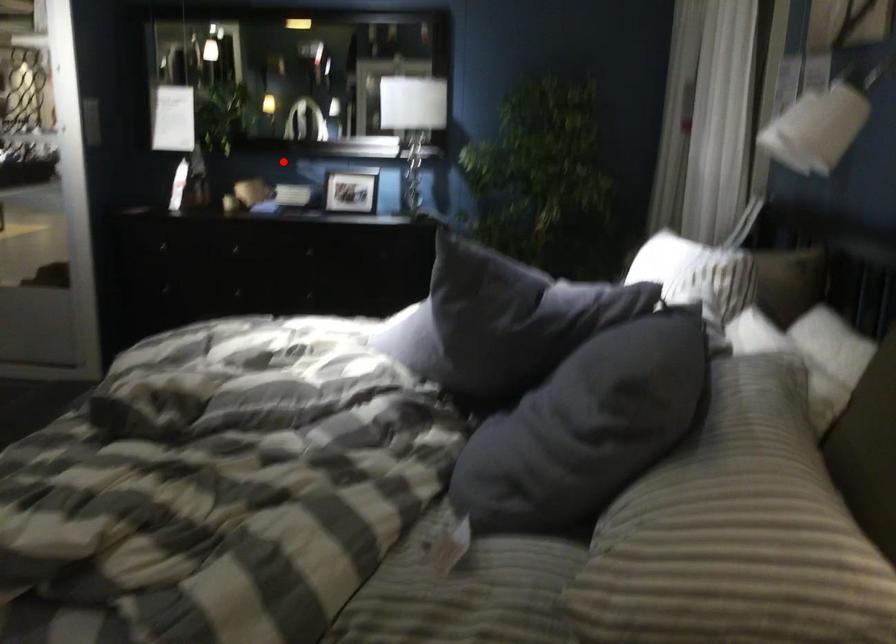
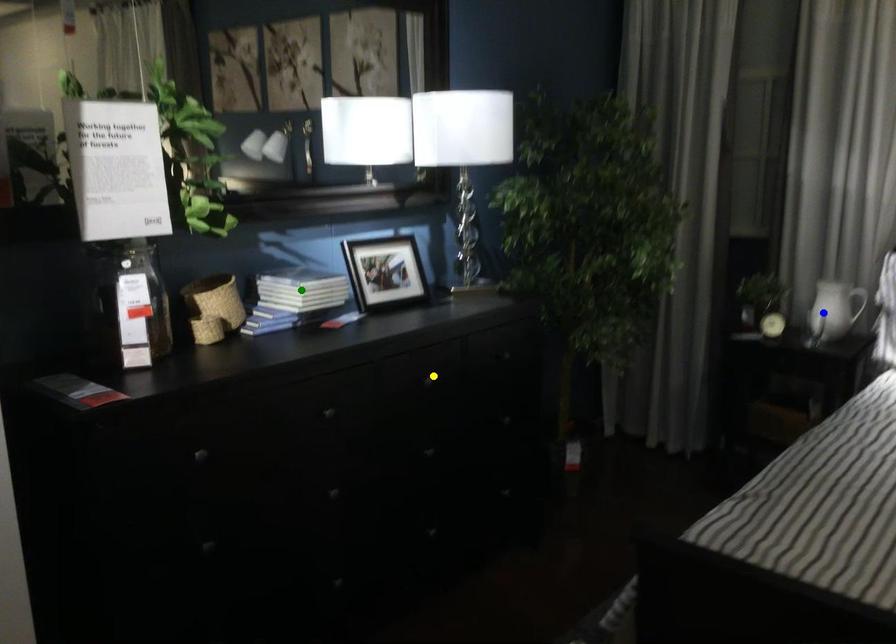
Question: I am providing you with two images of the same scene from different viewpoints. A red point is marked on the first image. You are given multiple points on the second image. Can you choose the point in image 2 that corresponds to the point in image 1?

Choices:
 (A) green point
 (B) blue point
 (C) yellow point

Answer: (A)